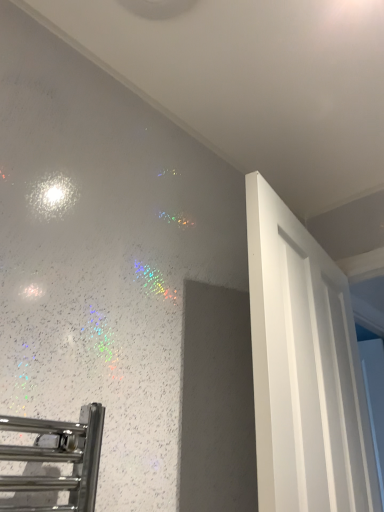
This screenshot has width=384, height=512. What do you see at coordinates (304, 369) in the screenshot? I see `white smooth door at right` at bounding box center [304, 369].

Measure the distance between white smooth door at right and camera.

white smooth door at right is 73.11 centimeters from camera.

At what (x,y) coordinates should I click in order to perform the action: click on white smooth door at right. Please return your answer as a coordinate pair (x, y). Looking at the image, I should click on (304, 369).

Image resolution: width=384 pixels, height=512 pixels. I want to click on white smooth door at right, so click(304, 369).